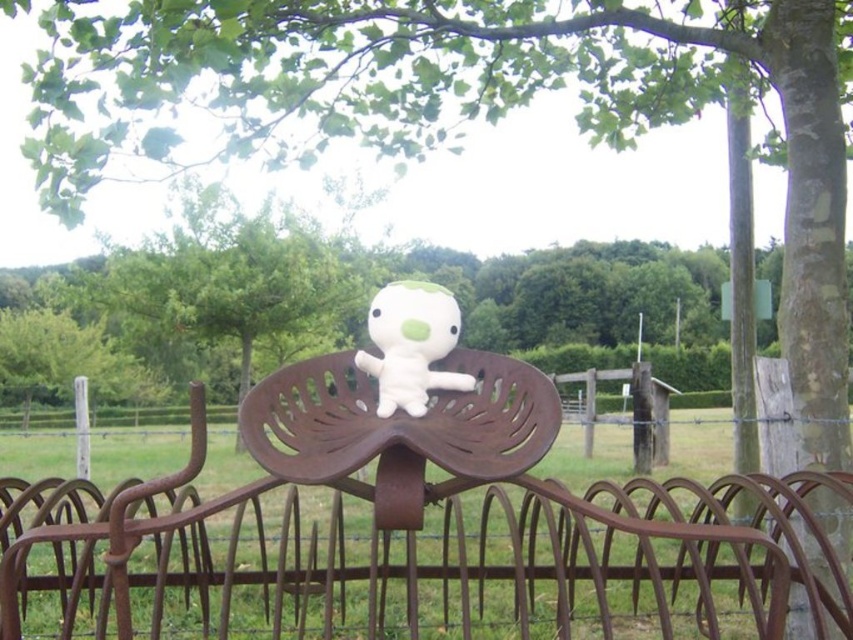
You are standing in a rural area and see two points marked in the scene. Which point is closer to you, point (492,540) or point (369,326)?

Point (492,540) is further to the viewer than point (369,326). Therefore, point (369,326) is closer to you.

You are standing at the point with coordinates (407,529) in the image. What object is located exactly at this point?

The rusty metal rake at center is located exactly at point (407,529).

You are a photographer trying to capture both the rusty metal rake at center and the white plush toy at center in a single shot. Since both are at the center, which object will appear larger in your photo?

The rusty metal rake at center is closer to the viewer than the white plush toy at center, so it will appear larger in the photo.